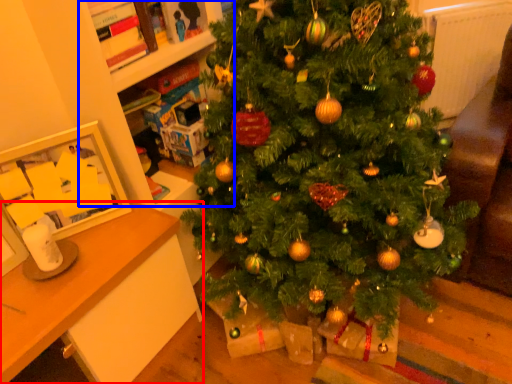
Question: Which of the following is the farthest to the observer, desk (highlighted by a red box) or bookshelf (highlighted by a blue box)?

Choices:
 (A) desk
 (B) bookshelf

Answer: (B)